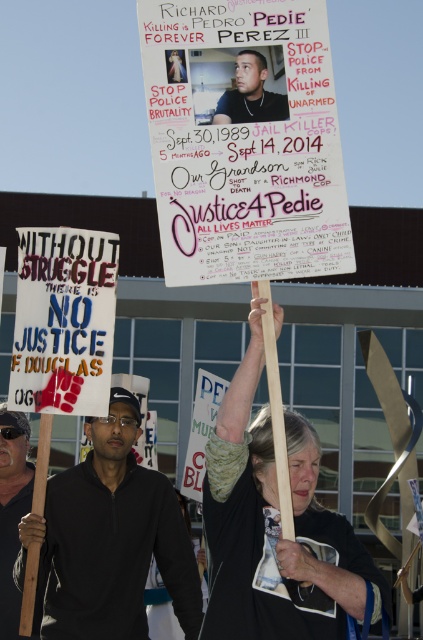
Is dark brown leather jacket at lower left wider than matte black face at upper center?

Correct, the width of dark brown leather jacket at lower left exceeds that of matte black face at upper center.

Which is behind, point (13, 604) or point (241, 104)?

The point (13, 604) is more distant.

Identify the location of dark brown leather jacket at lower left. This screenshot has height=640, width=423. 13,516.

This screenshot has height=640, width=423. Identify the location of dark brown leather jacket at lower left. (13, 516).

Which is more to the right, black matte shirt at center or matte black sign at lower left?

matte black sign at lower left is more to the right.

Which is behind, point (49, 560) or point (77, 328)?

The point (49, 560) is more distant.

Locate an element on the screen. This screenshot has height=640, width=423. black matte shirt at center is located at coordinates (112, 538).

Does white paper poster at center have a lesser height compared to dark brown leather jacket at lower left?

Indeed, white paper poster at center has a lesser height compared to dark brown leather jacket at lower left.

Which is behind, point (173, 225) or point (5, 531)?

The point (5, 531) is behind.

This screenshot has width=423, height=640. What are the coordinates of `white paper poster at center` in the screenshot? It's located at [x=244, y=140].